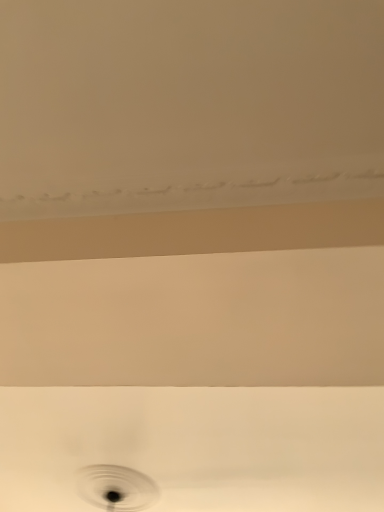
Question: From the image's perspective, does white glossy sink at center appear lower than black matte hole at center?

Choices:
 (A) no
 (B) yes

Answer: (A)

Question: Is white glossy sink at center shorter than black matte hole at center?

Choices:
 (A) no
 (B) yes

Answer: (B)

Question: Is white glossy sink at center further to the viewer compared to black matte hole at center?

Choices:
 (A) no
 (B) yes

Answer: (A)

Question: Can you confirm if white glossy sink at center is bigger than black matte hole at center?

Choices:
 (A) no
 (B) yes

Answer: (B)

Question: Would you say white glossy sink at center is outside black matte hole at center?

Choices:
 (A) no
 (B) yes

Answer: (B)

Question: Is white glossy sink at center at the right side of black matte hole at center?

Choices:
 (A) yes
 (B) no

Answer: (A)

Question: Does black matte hole at center turn towards white glossy sink at center?

Choices:
 (A) yes
 (B) no

Answer: (B)

Question: Is black matte hole at center positioned behind white glossy sink at center?

Choices:
 (A) no
 (B) yes

Answer: (B)

Question: Can you confirm if black matte hole at center is bigger than white glossy sink at center?

Choices:
 (A) yes
 (B) no

Answer: (B)

Question: From the image's perspective, is black matte hole at center under white glossy sink at center?

Choices:
 (A) yes
 (B) no

Answer: (A)

Question: From a real-world perspective, is black matte hole at center physically below white glossy sink at center?

Choices:
 (A) yes
 (B) no

Answer: (A)

Question: Can you confirm if black matte hole at center is shorter than white glossy sink at center?

Choices:
 (A) yes
 (B) no

Answer: (B)

Question: Considering the positions of point coord(67,409) and point coord(147,501), is point coord(67,409) closer or farther from the camera than point coord(147,501)?

Choices:
 (A) farther
 (B) closer

Answer: (B)